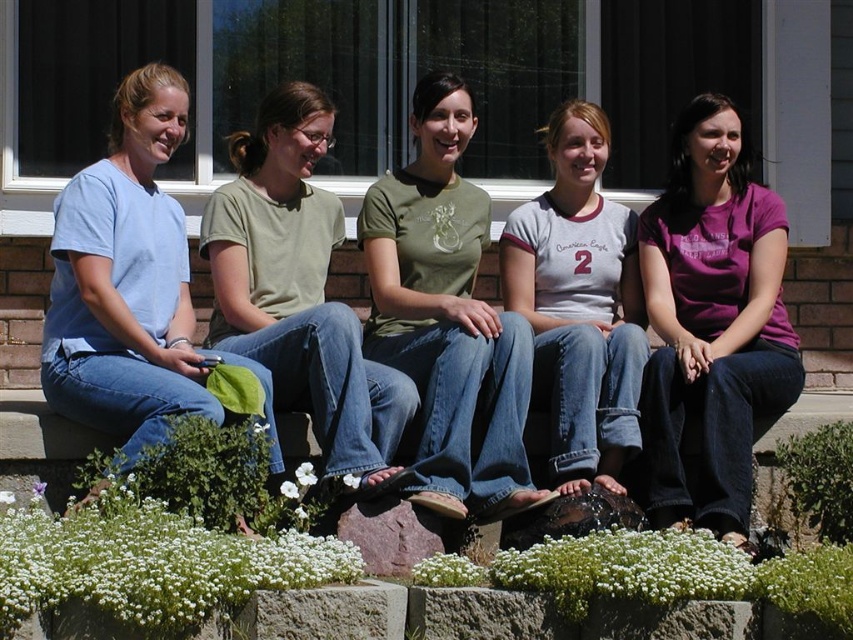
Question: Does matte green t-shirt at center appear on the right side of matte gray t-shirt at center?

Choices:
 (A) yes
 (B) no

Answer: (B)

Question: Can you confirm if purple cotton shirt at center is positioned to the right of matte green t-shirt at center?

Choices:
 (A) no
 (B) yes

Answer: (B)

Question: Does purple cotton shirt at center have a greater width compared to light blue t-shirt at left?

Choices:
 (A) yes
 (B) no

Answer: (B)

Question: Among these points, which one is nearest to the camera?

Choices:
 (A) (733, 371)
 (B) (259, 172)
 (C) (519, 372)

Answer: (C)

Question: Estimate the real-world distances between objects in this image. Which object is closer to the purple cotton shirt at center?

Choices:
 (A) light blue t-shirt at left
 (B) matte gray t-shirt at center
 (C) matte green t-shirt at center

Answer: (B)

Question: Which of the following is the farthest from the observer?

Choices:
 (A) (561, 422)
 (B) (131, 352)

Answer: (A)